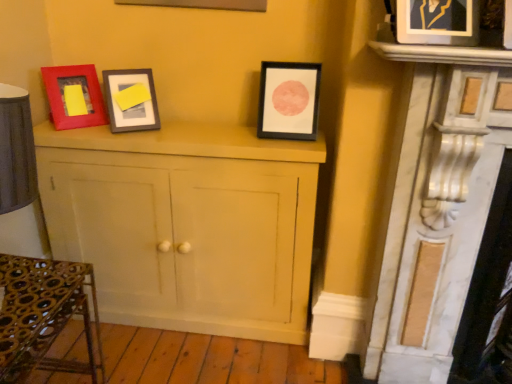
Where is `free location in front of black matte picture frame at center, the second picture frame when ordered from right to left`? The height and width of the screenshot is (384, 512). free location in front of black matte picture frame at center, the second picture frame when ordered from right to left is located at coordinates (286, 145).